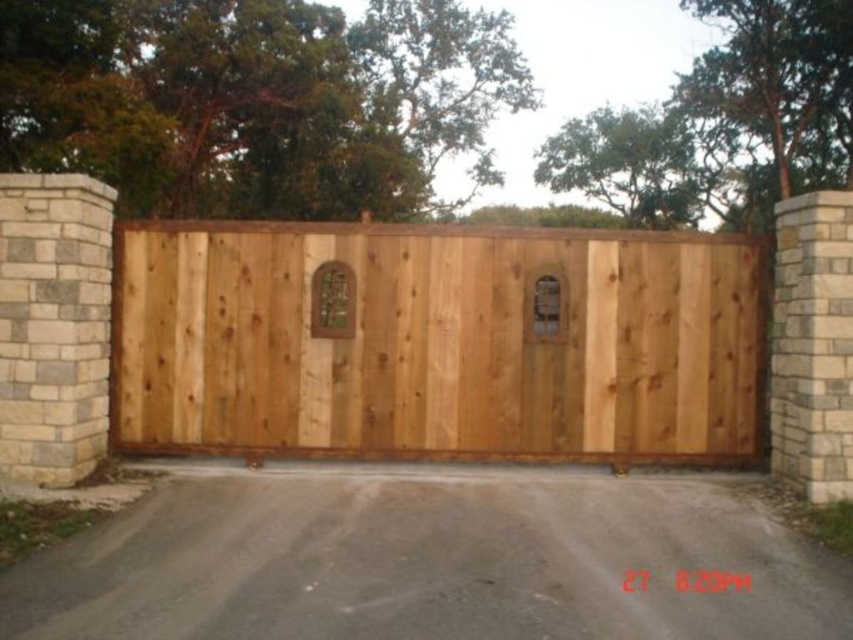
You are standing at the entrance of the property and want to walk towards the gate. Which point, point (490, 246) or point (532, 308), is closer to you as you approach the gate?

Point (532, 308) is closer to you since it is in front of point (490, 246), which is behind it.

You are driving a delivery truck that is 2.5 meters wide. You arrive at this property and see the gray concrete driveway at center and the natural wood door at center. Can your truck fit through the opening between them?

The gray concrete driveway at center is wider than the natural wood door at center. Since the driveway is wider, the truck can likely fit through the opening between them as long as the width is sufficient for the truck.

You are a delivery person trying to enter the property. You see the natural wood gate at center and the natural wood door at center. Which one should you open to enter?

You should open the natural wood gate at center because it is located below the natural wood door at center, which likely means the door is part of a building and the gate is the entrance to the property.